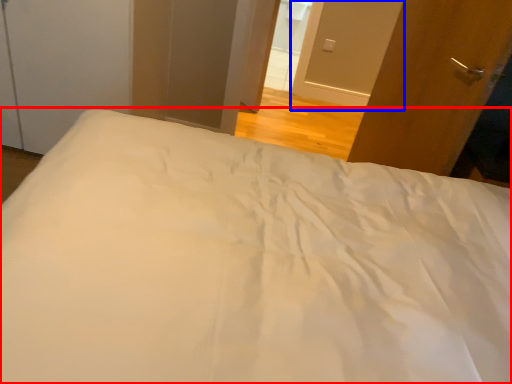
Question: Which of the following is the closest to the observer, bed (highlighted by a red box) or screen door (highlighted by a blue box)?

Choices:
 (A) bed
 (B) screen door

Answer: (A)